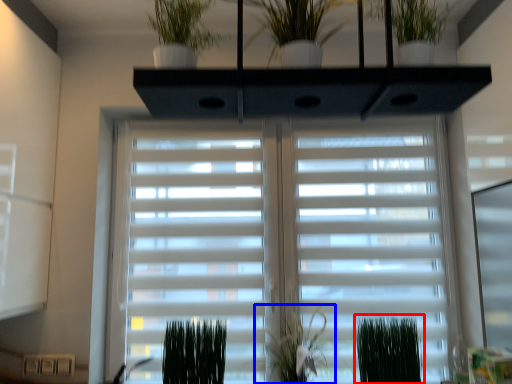
Question: Which point is closer to the camera, plant (highlighted by a red box) or plant (highlighted by a blue box)?

Choices:
 (A) plant
 (B) plant

Answer: (A)